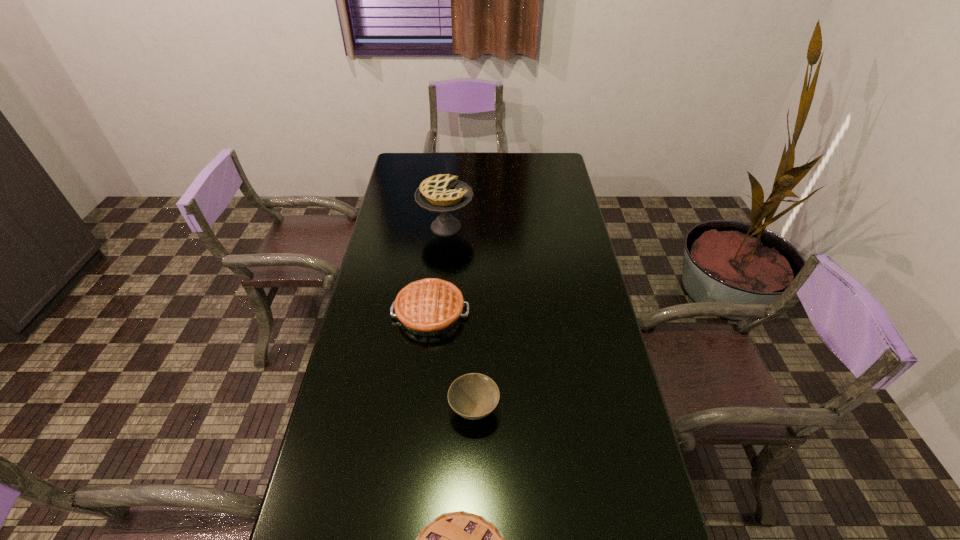
Locate which object ranks in proximity to the second shortest pie. Please provide its 2D coordinates. Your answer should be formatted as a tuple, i.e. [(x, y)], where the tuple contains the x and y coordinates of a point satisfying the conditions above.

[(473, 396)]

Identify which pie is the second nearest to the third nearest object. Please provide its 2D coordinates. Your answer should be formatted as a tuple, i.e. [(x, y)], where the tuple contains the x and y coordinates of a point satisfying the conditions above.

[(460, 539)]

Identify which pie is the closest to the second nearest object. Please provide its 2D coordinates. Your answer should be formatted as a tuple, i.e. [(x, y)], where the tuple contains the x and y coordinates of a point satisfying the conditions above.

[(428, 307)]

The height and width of the screenshot is (540, 960). I want to click on vacant space that satisfies the following two spatial constraints: 1. on the cut side of the second nearest object; 2. on the left side of the farthest pie, so click(429, 410).